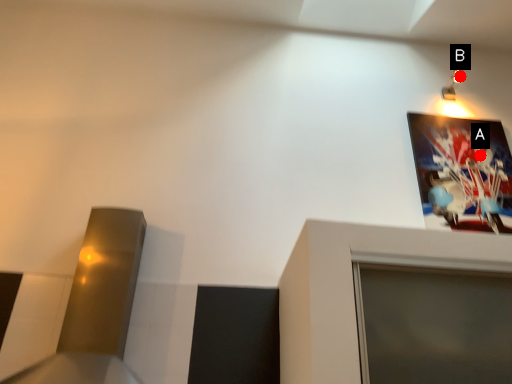
Question: Two points are circled on the image, labeled by A and B beside each circle. Which point is closer to the camera?

Choices:
 (A) A is closer
 (B) B is closer

Answer: (A)